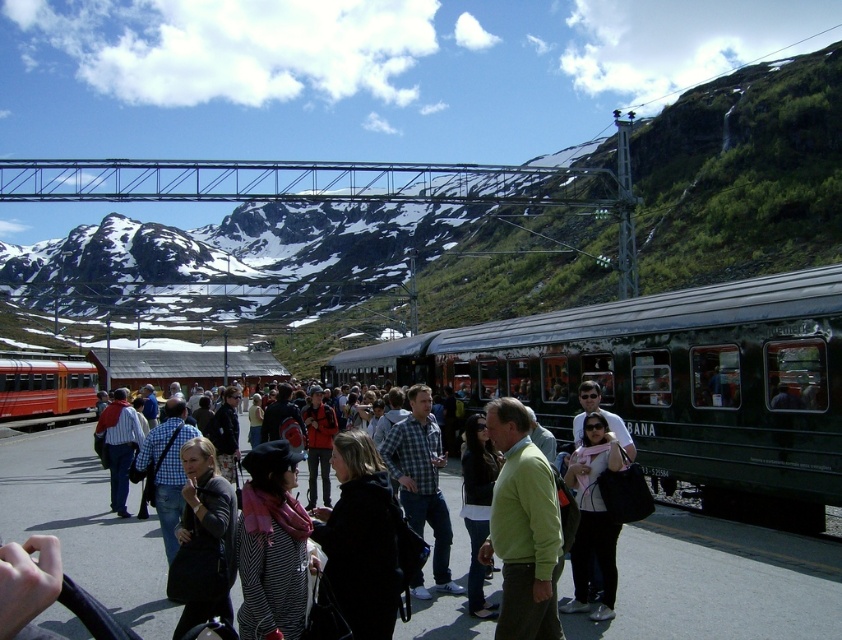
Question: Which point is closer to the camera?

Choices:
 (A) matte black people at center
 (B) green sweater at center

Answer: (B)

Question: Does green matte train at center have a larger size compared to matte black jacket at center?

Choices:
 (A) yes
 (B) no

Answer: (A)

Question: Considering the real-world distances, which object is closest to the matte black people at center?

Choices:
 (A) matte red train at left
 (B) green matte train at center
 (C) matte black jacket at center

Answer: (C)

Question: Among these points, which one is farthest from the camera?

Choices:
 (A) (9, 364)
 (B) (582, 564)
 (C) (342, 374)

Answer: (C)

Question: Is matte black people at center above matte black jacket at center?

Choices:
 (A) no
 (B) yes

Answer: (A)

Question: Is green sweater at center further to camera compared to matte red train at left?

Choices:
 (A) yes
 (B) no

Answer: (B)